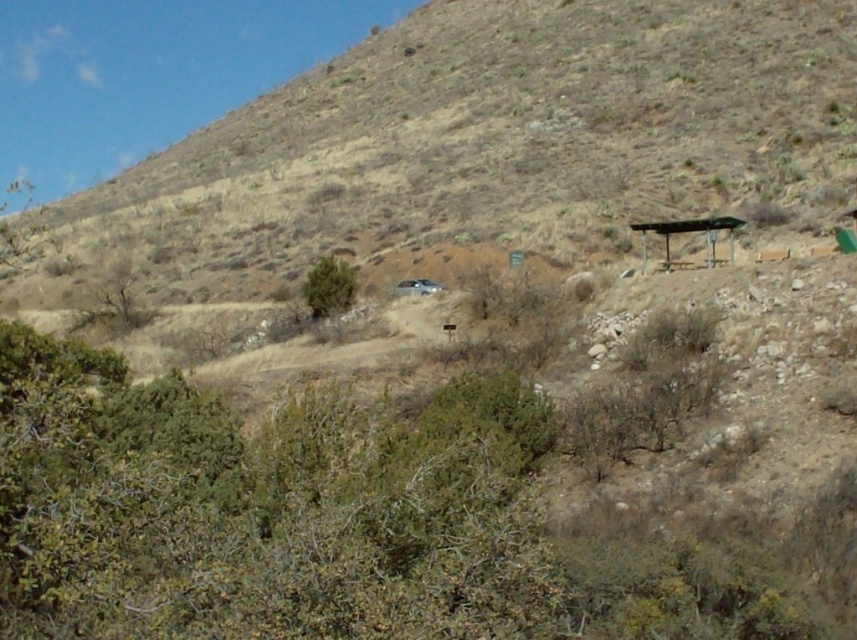
Question: Which is nearer to the metallic silver bus stop at right?

Choices:
 (A) green leafy bush at center
 (B) brown/dry grass at center

Answer: (A)

Question: Can you confirm if green leafy bush at center is positioned to the right of metallic silver bus stop at right?

Choices:
 (A) no
 (B) yes

Answer: (A)

Question: Estimate the real-world distances between objects in this image. Which object is farther from the green leafy bush at center?

Choices:
 (A) metallic silver bus stop at right
 (B) brown/dry grass at center

Answer: (B)

Question: Among these points, which one is nearest to the camera?

Choices:
 (A) (486, 177)
 (B) (667, 221)

Answer: (B)

Question: Is brown/dry grass at center thinner than green leafy bush at center?

Choices:
 (A) no
 (B) yes

Answer: (A)

Question: Is green leafy bush at center further to camera compared to metallic silver bus stop at right?

Choices:
 (A) yes
 (B) no

Answer: (A)